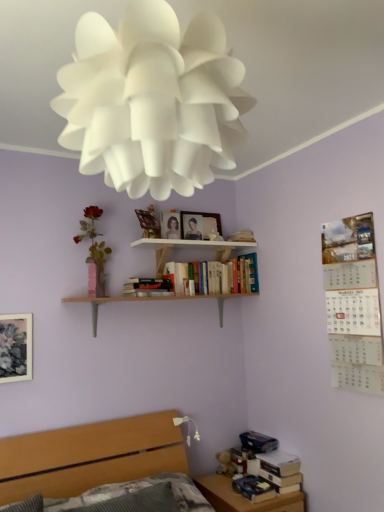
Question: From the image's perspective, does matte wooden picture frame at upper center, arranged as the second picture frame when viewed from the top, appear lower than white paper flower at upper center, the 2th flower positioned from the back?

Choices:
 (A) no
 (B) yes

Answer: (B)

Question: Is matte wooden picture frame at upper center, which is the 2th picture frame in bottom-to-top order, wider than white paper flower at upper center, the first flower viewed from the front?

Choices:
 (A) no
 (B) yes

Answer: (A)

Question: Can you confirm if matte wooden picture frame at upper center, which is the 2th picture frame in bottom-to-top order, is taller than white paper flower at upper center, the first flower viewed from the front?

Choices:
 (A) no
 (B) yes

Answer: (A)

Question: Can you confirm if matte wooden picture frame at upper center, arranged as the second picture frame when viewed from the top, is positioned to the right of white paper flower at upper center, which ranks as the 2th flower in left-to-right order?

Choices:
 (A) yes
 (B) no

Answer: (B)

Question: Would you consider matte wooden picture frame at upper center, which is the 2th picture frame in bottom-to-top order, to be distant from white paper flower at upper center, which ranks as the 2th flower in left-to-right order?

Choices:
 (A) no
 (B) yes

Answer: (B)

Question: Do you think matte wooden picture frame at upper center, arranged as the 2th picture frame when viewed from the back, is within matte pink vase at left, which is counted as the first flower, starting from the left, or outside of it?

Choices:
 (A) outside
 (B) inside

Answer: (A)

Question: Is matte wooden picture frame at upper center, placed as the 2th picture frame when sorted from front to back, wider or thinner than matte pink vase at left, the second flower from the front?

Choices:
 (A) wide
 (B) thin

Answer: (B)

Question: From the image's perspective, relative to matte pink vase at left, the first flower in the back-to-front sequence, is matte wooden picture frame at upper center, acting as the 2th picture frame starting from the left, above or below?

Choices:
 (A) below
 (B) above

Answer: (B)

Question: From a real-world perspective, is matte wooden picture frame at upper center, arranged as the 2th picture frame when viewed from the back, above or below matte pink vase at left, which is counted as the first flower, starting from the left?

Choices:
 (A) above
 (B) below

Answer: (A)

Question: From a real-world perspective, is matte floral print picture frame at left, which is counted as the 3th picture frame, starting from the right, above or below hardcover books at center, marked as the second book in a top-to-bottom arrangement?

Choices:
 (A) below
 (B) above

Answer: (A)

Question: From the image's perspective, is matte floral print picture frame at left, arranged as the 3th picture frame when viewed from the back, positioned above or below hardcover books at center, the 4th book in the bottom-to-top sequence?

Choices:
 (A) below
 (B) above

Answer: (A)

Question: Considering the positions of matte floral print picture frame at left, the third picture frame from the top, and hardcover books at center, the 4th book in the bottom-to-top sequence, in the image, is matte floral print picture frame at left, the third picture frame from the top, bigger or smaller than hardcover books at center, the 4th book in the bottom-to-top sequence,?

Choices:
 (A) big
 (B) small

Answer: (B)

Question: Considering their positions, is matte floral print picture frame at left, the third picture frame from the top, located in front of or behind hardcover books at center, marked as the second book in a top-to-bottom arrangement?

Choices:
 (A) behind
 (B) front

Answer: (B)

Question: Is wooden bed at lower left spatially inside wooden bookshelf at upper center, the 1th shelf when ordered from top to bottom, or outside of it?

Choices:
 (A) outside
 (B) inside

Answer: (A)

Question: Considering the positions of wooden bed at lower left and wooden bookshelf at upper center, the 1th shelf when ordered from top to bottom, in the image, is wooden bed at lower left bigger or smaller than wooden bookshelf at upper center, the 1th shelf when ordered from top to bottom,?

Choices:
 (A) small
 (B) big

Answer: (B)